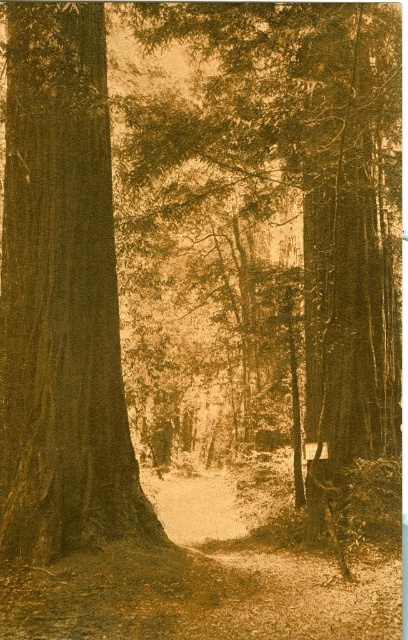
You are a hiker carrying a backpack and want to pass between the smooth brown tree trunk at center and the smooth brown tree trunk at left. The width of your backpack is 0.5 meters. Is there enough space for you to pass through?

The smooth brown tree trunk at center is 2.88 meters away from the smooth brown tree trunk at left. Since your backpack is only 0.5 meters wide, there is more than enough space to pass through safely.